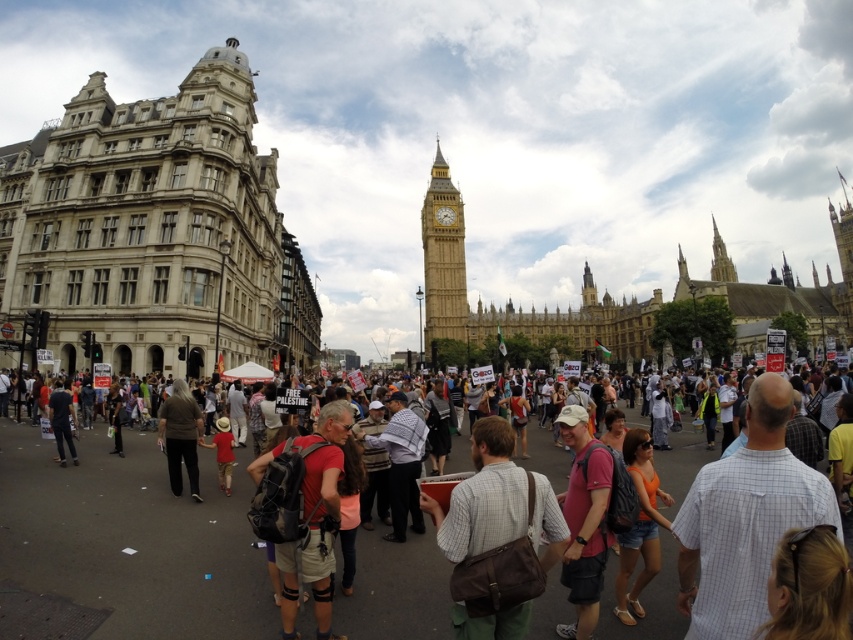
Question: Estimate the real-world distances between objects in this image. Which object is closer to the light brown hair at lower right?

Choices:
 (A) brown leather bag at center
 (B) stone textured building at left
 (C) multicolored fabric crowd at center

Answer: (A)

Question: Does stone textured building at left appear on the right side of light brown hair at lower right?

Choices:
 (A) no
 (B) yes

Answer: (A)

Question: Is brown leather bag at center bigger than light brown hair at lower right?

Choices:
 (A) yes
 (B) no

Answer: (A)

Question: Among these objects, which one is farthest from the camera?

Choices:
 (A) matte black backpack at center
 (B) multicolored fabric crowd at center

Answer: (A)

Question: Can you confirm if orange denim shorts at center is bigger than dark blue jeans at center?

Choices:
 (A) no
 (B) yes

Answer: (B)

Question: Which point is closer to the camera?

Choices:
 (A) golden stone clock tower at center
 (B) orange denim shorts at center

Answer: (B)